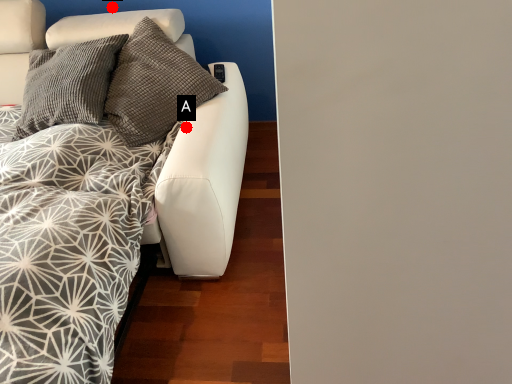
Question: Two points are circled on the image, labeled by A and B beside each circle. Which point is farther from the camera taking this photo?

Choices:
 (A) A is further
 (B) B is further

Answer: (B)